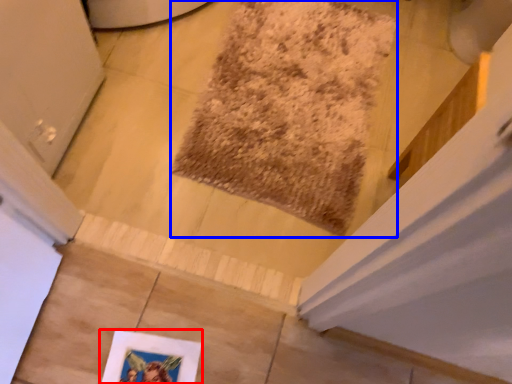
Question: Among these objects, which one is farthest to the camera, picture frame (highlighted by a red box) or mat (highlighted by a blue box)?

Choices:
 (A) picture frame
 (B) mat

Answer: (B)